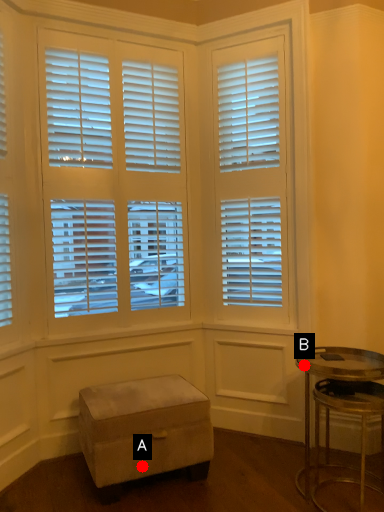
Question: Two points are circled on the image, labeled by A and B beside each circle. Among these points, which one is farthest from the camera?

Choices:
 (A) A is further
 (B) B is further

Answer: (B)